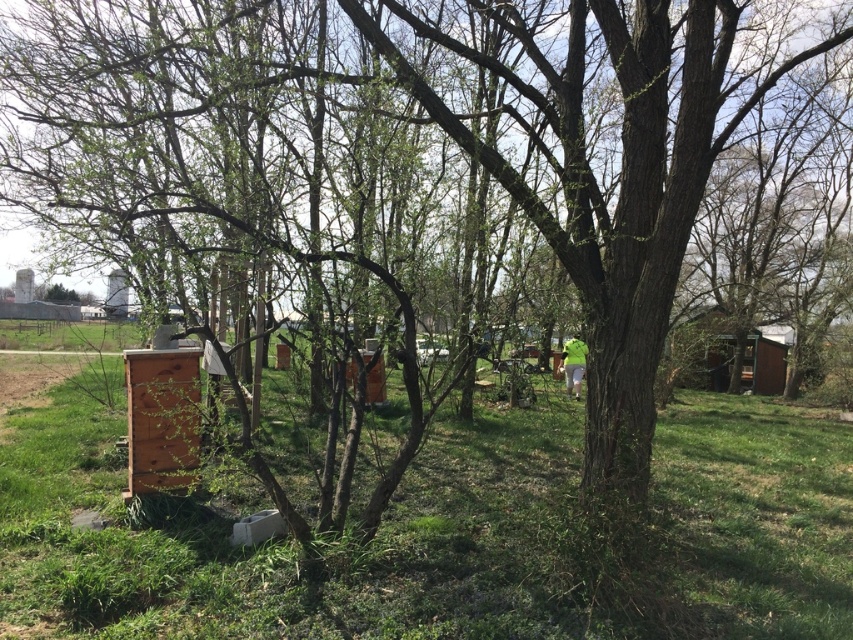
Does green grass at lower left appear on the right side of wooden hut at right?

No, green grass at lower left is not to the right of wooden hut at right.

Between green grass at lower left and wooden hut at right, which one appears on the right side from the viewer's perspective?

Positioned to the right is wooden hut at right.

This screenshot has height=640, width=853. What do you see at coordinates (445, 536) in the screenshot?
I see `green grass at lower left` at bounding box center [445, 536].

Find the location of `green grass at lower left`. green grass at lower left is located at coordinates (445, 536).